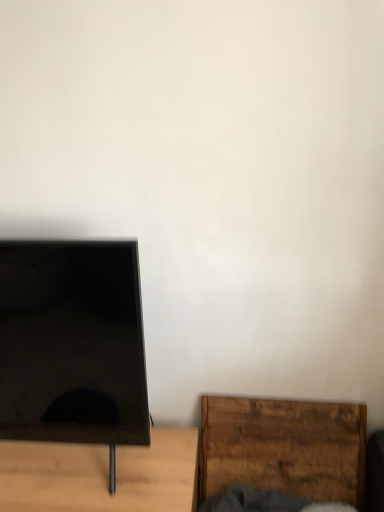
In order to click on free spot below black glossy screen at left (from a real-world perspective) in this screenshot , I will do `click(67, 463)`.